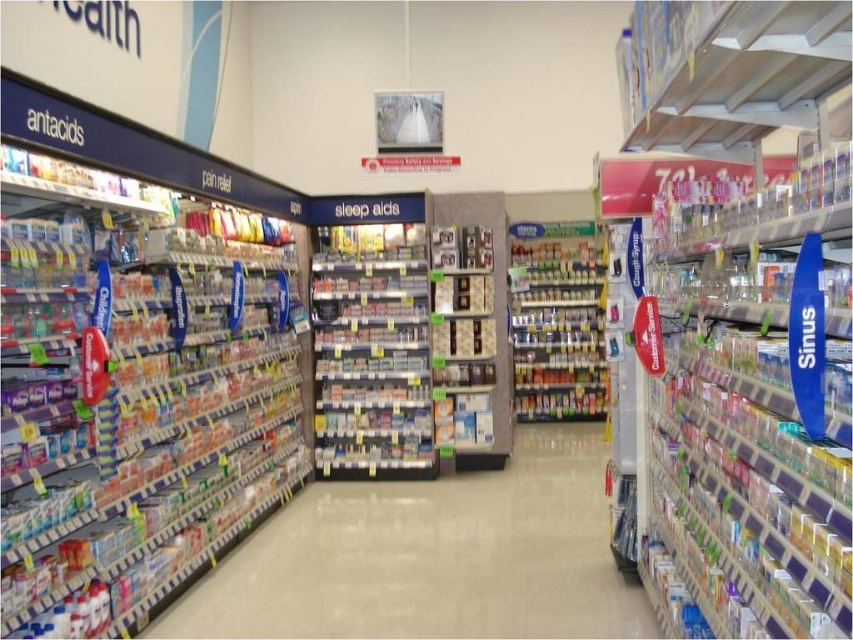
Is matte plastic antacids at left to the left of metallic silver spice rack at center from the viewer's perspective?

Correct, you'll find matte plastic antacids at left to the left of metallic silver spice rack at center.

This screenshot has height=640, width=853. In order to click on matte plastic antacids at left in this screenshot , I will do `click(134, 394)`.

The width and height of the screenshot is (853, 640). I want to click on matte plastic antacids at left, so click(x=134, y=394).

In the scene shown: Can you confirm if white plastic shelves at center is bigger than metallic silver spice rack at center?

Indeed, white plastic shelves at center has a larger size compared to metallic silver spice rack at center.

Who is more distant from viewer, (x=370, y=614) or (x=598, y=248)?

The point (x=598, y=248) is more distant.

Locate an element on the screen. This screenshot has height=640, width=853. white plastic shelves at center is located at coordinates (431, 557).

Does matte plastic antacids at left have a lesser width compared to white plastic shelves at center?

Yes.

Who is more forward, [7,524] or [457,532]?

Point [7,524] is in front.

The height and width of the screenshot is (640, 853). Identify the location of matte plastic antacids at left. (x=134, y=394).

I want to click on matte plastic antacids at left, so click(134, 394).